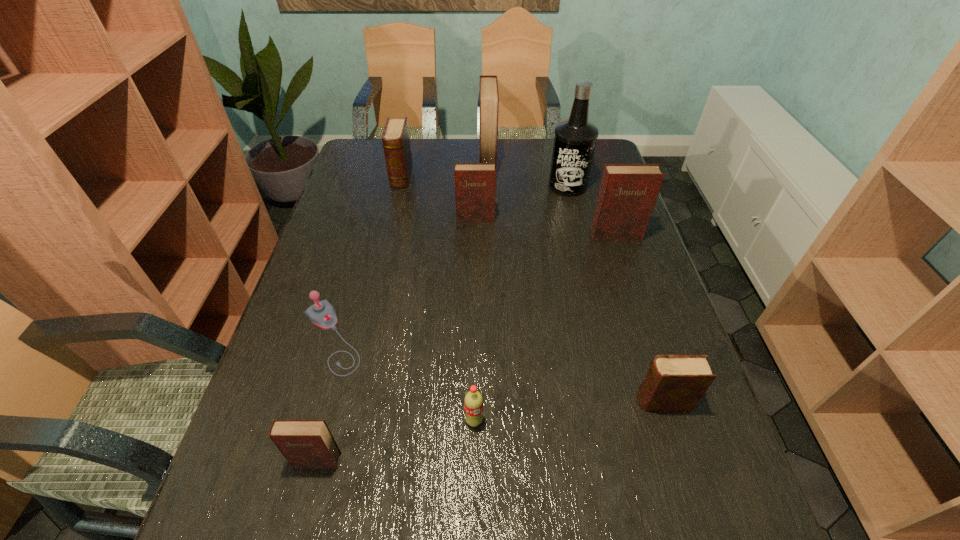
This screenshot has width=960, height=540. I want to click on the tallest object, so click(x=575, y=139).

Find the location of a particular element. This screenshot has height=540, width=960. black liquor is located at coordinates (575, 139).

You are a GUI agent. You are given a task and a screenshot of the screen. Output one action in this format:
    pyautogui.click(x=<x>, y=<y>)
    Task: Click on the biggest reddish-brown diary
    This screenshot has width=960, height=540.
    Given the screenshot: What is the action you would take?
    pyautogui.click(x=488, y=94)

Image resolution: width=960 pixels, height=540 pixels. What are the coordinates of `the eighth shortest object` in the screenshot? It's located at (488, 94).

You are a GUI agent. You are given a task and a screenshot of the screen. Output one action in this format:
    pyautogui.click(x=<x>, y=<y>)
    Task: Click on the second biggest reddish-brown diary
    
    Given the screenshot: What is the action you would take?
    pyautogui.click(x=628, y=192)

I want to click on the second nearest reddish-brown diary, so click(x=628, y=192).

Where is `the farther brown diary`? the farther brown diary is located at coordinates (396, 143).

The height and width of the screenshot is (540, 960). I want to click on the bigger brown diary, so click(396, 143).

Locate an element on the screen. the third farthest diary is located at coordinates (475, 183).

What are the coordinates of `the second farthest reddish-brown diary` in the screenshot? It's located at (475, 183).